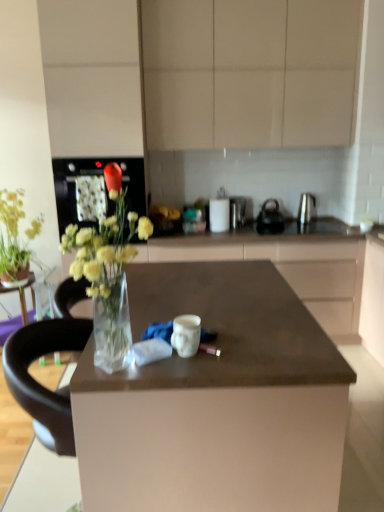
Find the location of a particular element. The width and height of the screenshot is (384, 512). free space in front of white paper towel at center, arranged as the 1th appliance when viewed from the left is located at coordinates (216, 234).